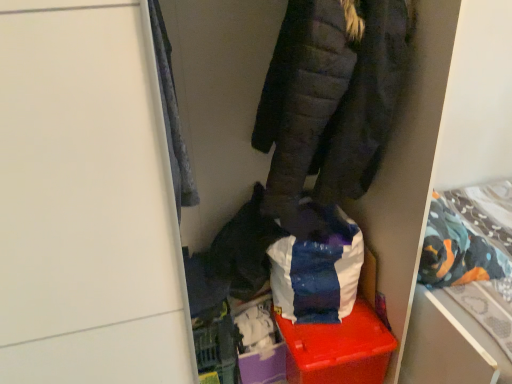
Question: Is patterned fabric bed at right turned away from velvety gray blanket at upper left?

Choices:
 (A) yes
 (B) no

Answer: (B)

Question: Is patterned fabric bed at right at the left side of velvety gray blanket at upper left?

Choices:
 (A) yes
 (B) no

Answer: (B)

Question: Is patterned fabric bed at right taller than velvety gray blanket at upper left?

Choices:
 (A) no
 (B) yes

Answer: (A)

Question: Considering the relative sizes of patterned fabric bed at right and velvety gray blanket at upper left in the image provided, is patterned fabric bed at right bigger than velvety gray blanket at upper left?

Choices:
 (A) yes
 (B) no

Answer: (A)

Question: Can you confirm if patterned fabric bed at right is shorter than velvety gray blanket at upper left?

Choices:
 (A) yes
 (B) no

Answer: (A)

Question: Considering their positions, is dark gray quilted jacket at upper center located in front of or behind velvety gray blanket at upper left?

Choices:
 (A) front
 (B) behind

Answer: (B)

Question: Is dark gray quilted jacket at upper center situated inside velvety gray blanket at upper left or outside?

Choices:
 (A) outside
 (B) inside

Answer: (A)

Question: From a real-world perspective, is dark gray quilted jacket at upper center physically located above or below velvety gray blanket at upper left?

Choices:
 (A) above
 (B) below

Answer: (B)

Question: Is dark gray quilted jacket at upper center to the left or to the right of velvety gray blanket at upper left in the image?

Choices:
 (A) left
 (B) right

Answer: (B)

Question: Relative to matte plastic storage box at center, is patterned fabric bed at right in front or behind?

Choices:
 (A) behind
 (B) front

Answer: (B)

Question: Would you say patterned fabric bed at right is inside or outside matte plastic storage box at center?

Choices:
 (A) inside
 (B) outside

Answer: (B)

Question: From the image's perspective, is patterned fabric bed at right above or below matte plastic storage box at center?

Choices:
 (A) below
 (B) above

Answer: (B)

Question: Considering the positions of patterned fabric bed at right and matte plastic storage box at center in the image, is patterned fabric bed at right bigger or smaller than matte plastic storage box at center?

Choices:
 (A) big
 (B) small

Answer: (A)

Question: In terms of height, does dark gray quilted jacket at upper center look taller or shorter compared to patterned fabric bed at right?

Choices:
 (A) tall
 (B) short

Answer: (A)

Question: In the image, is dark gray quilted jacket at upper center positioned in front of or behind patterned fabric bed at right?

Choices:
 (A) front
 (B) behind

Answer: (A)